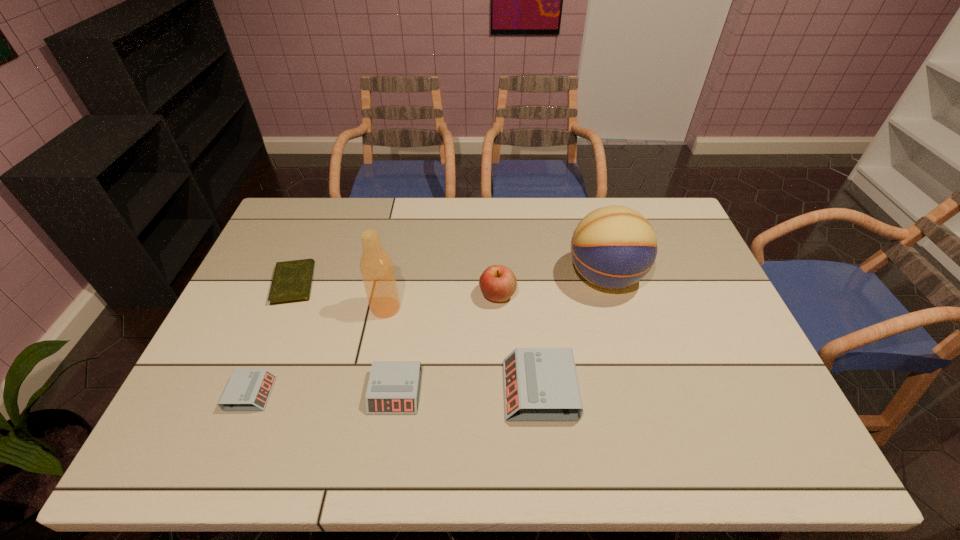
What are the coordinates of `diary that is at the left edge` in the screenshot? It's located at (292, 280).

Identify the location of object that is at the near left corner. The height and width of the screenshot is (540, 960). (247, 389).

This screenshot has width=960, height=540. Find the location of `vacant region at the far edge of the desktop`. vacant region at the far edge of the desktop is located at coordinates (415, 208).

Where is `free region at the left edge of the desktop`? This screenshot has height=540, width=960. free region at the left edge of the desktop is located at coordinates (282, 310).

This screenshot has height=540, width=960. I want to click on free region at the right edge, so click(674, 288).

The image size is (960, 540). In order to click on vacant space at the far left corner of the desktop in this screenshot , I will do `click(318, 202)`.

Where is `vacant region at the near left corner of the desktop`? This screenshot has width=960, height=540. vacant region at the near left corner of the desktop is located at coordinates (185, 406).

Identify the location of free region at the far right corner of the desktop. This screenshot has width=960, height=540. (676, 225).

This screenshot has height=540, width=960. What are the coordinates of `free space between the beer bottle and the rightmost alarm clock` in the screenshot? It's located at click(x=463, y=349).

Identify the location of empty space that is in between the sixth tallest object and the third tallest object. (374, 344).